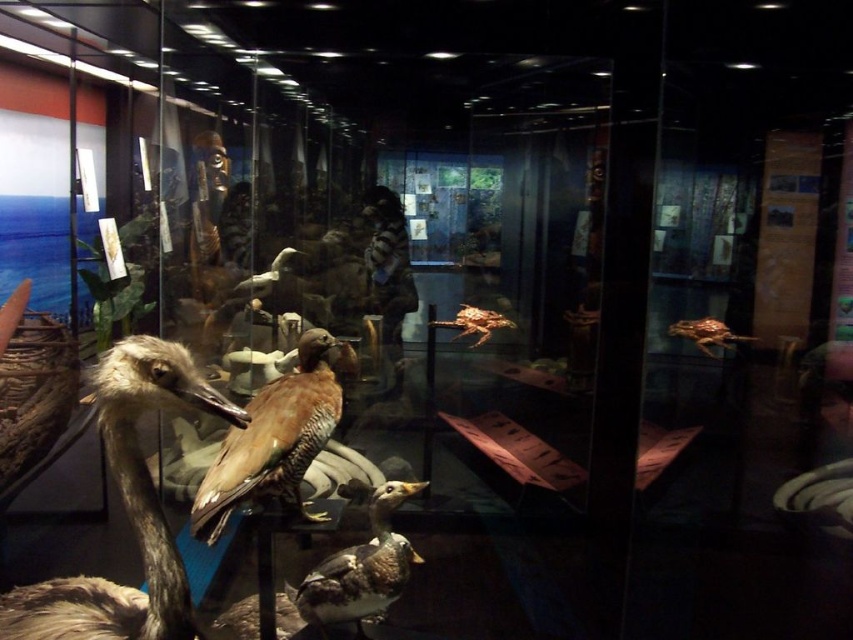
Can you confirm if brown speckled feathers at center is wider than brown matte duck at center?

Indeed, brown speckled feathers at center has a greater width compared to brown matte duck at center.

Which is in front, point (315, 404) or point (289, 252)?

Point (315, 404) is more forward.

Where is `brown speckled feathers at center`? The width and height of the screenshot is (853, 640). brown speckled feathers at center is located at coordinates (276, 438).

Is brown feathered bird at left behind brown feathered bird at right?

No, it is in front of brown feathered bird at right.

Where is `brown feathered bird at left`? brown feathered bird at left is located at coordinates (126, 508).

In order to click on brown feathered bird at left in this screenshot , I will do `click(126, 508)`.

Can you confirm if brown feathered bird at left is positioned to the left of brown feathered duck at center?

Indeed, brown feathered bird at left is positioned on the left side of brown feathered duck at center.

Is brown feathered bird at left below brown feathered duck at center?

Incorrect, brown feathered bird at left is not positioned below brown feathered duck at center.

Is point (140, 387) positioned in front of point (328, 595)?

That is True.

Find the location of a particular element. This screenshot has width=853, height=640. brown feathered bird at left is located at coordinates (126, 508).